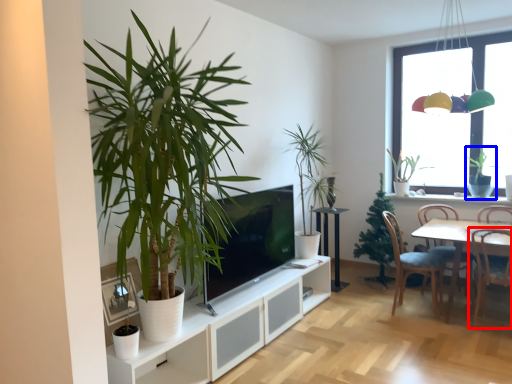
Question: Which point is further to the camera, chair (highlighted by a red box) or houseplant (highlighted by a blue box)?

Choices:
 (A) chair
 (B) houseplant

Answer: (B)